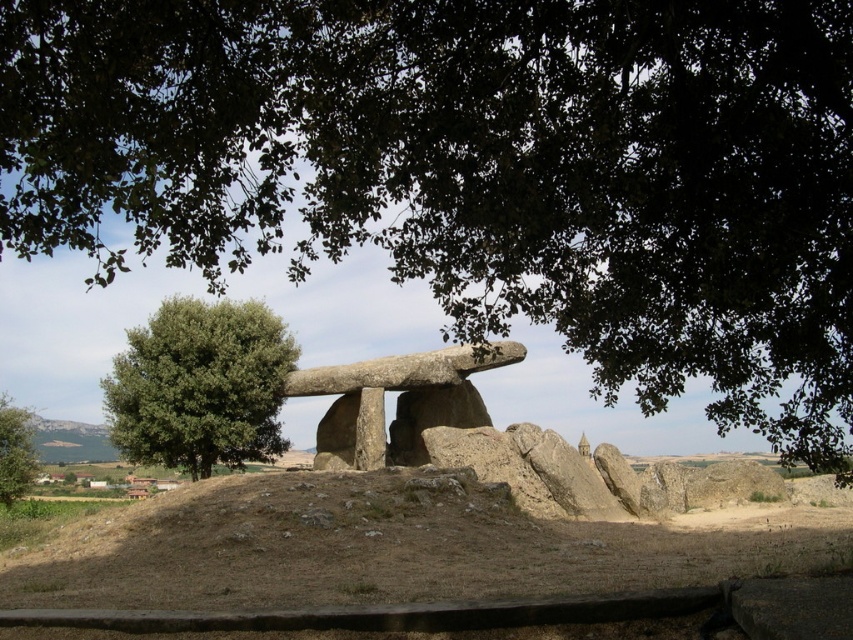
Is brown soil at center positioned in front of green leafy tree at left?

Yes, it is in front of green leafy tree at left.

Is the position of brown soil at center more distant than that of green leafy tree at left?

That is False.

Is point (392, 579) closer to camera compared to point (262, 349)?

Yes, it is in front of point (262, 349).

Find the location of `brown soil at center`. brown soil at center is located at coordinates [393, 547].

Is point (461, 481) in front of point (1, 468)?

Yes, it is in front of point (1, 468).

Which is below, brown soil at center or green leafy tree at lower left?

brown soil at center

Image resolution: width=853 pixels, height=640 pixels. Describe the element at coordinates (393, 547) in the screenshot. I see `brown soil at center` at that location.

You are a GUI agent. You are given a task and a screenshot of the screen. Output one action in this format:
    pyautogui.click(x=<x>, y=<y>)
    Task: Click on the brown soil at center
    This screenshot has height=640, width=853.
    Given the screenshot: What is the action you would take?
    pyautogui.click(x=393, y=547)

Between point (277, 424) and point (18, 486), which one is positioned behind?

The point (277, 424) is more distant.

Is point (181, 460) behind point (15, 467)?

Yes, point (181, 460) is behind point (15, 467).

You are a GUI agent. You are given a task and a screenshot of the screen. Output one action in this format:
    pyautogui.click(x=<x>, y=<y>)
    Task: Click on the green leafy tree at left
    
    Given the screenshot: What is the action you would take?
    pyautogui.click(x=200, y=385)